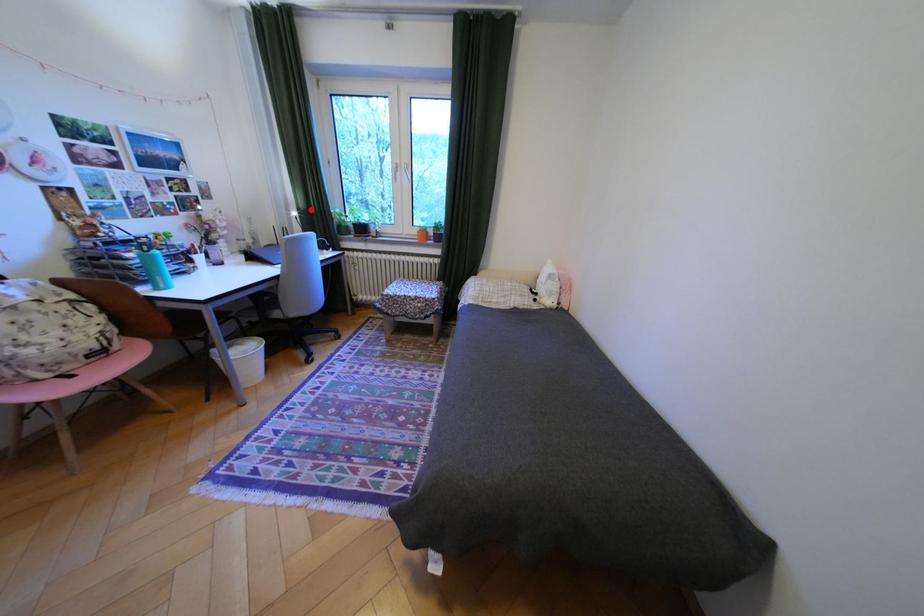
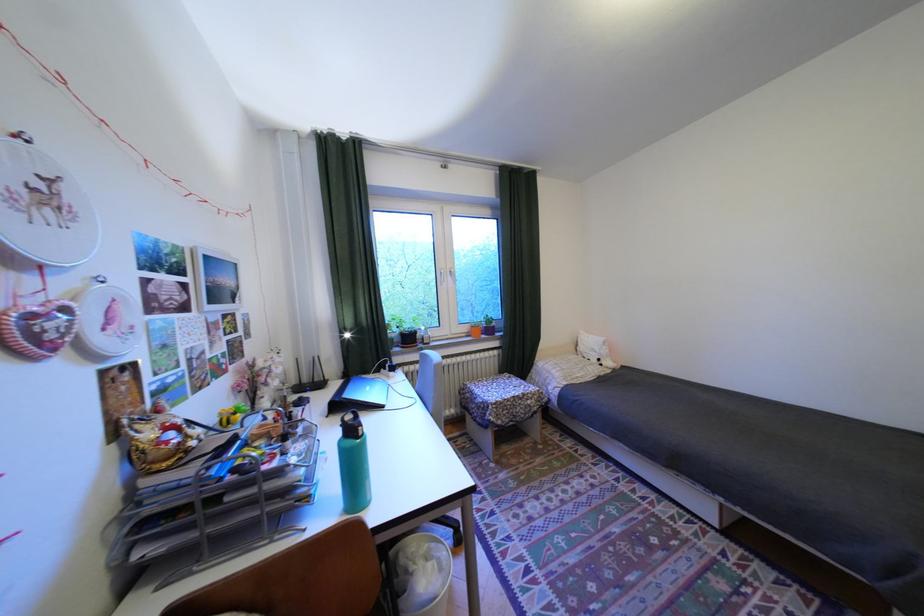
The point at the highlighted location is marked in the first image. Where is the corresponding point in the second image?

(354, 330)